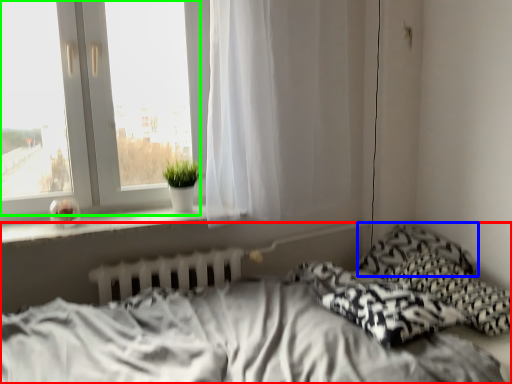
Question: Which is nearer to the bed (highlighted by a red box)? pillow (highlighted by a blue box) or bay window (highlighted by a green box).

Choices:
 (A) pillow
 (B) bay window

Answer: (A)